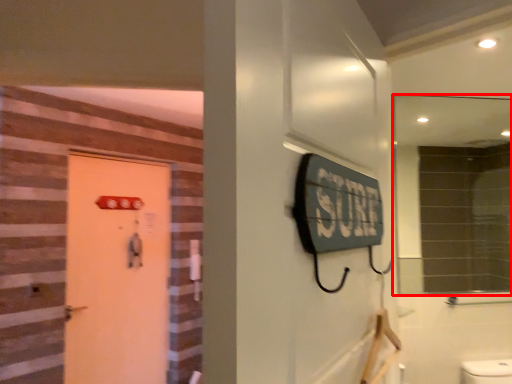
Question: From the image's perspective, what is the correct spatial relationship of mirror (annotated by the red box) in relation to door?

Choices:
 (A) below
 (B) above

Answer: (B)